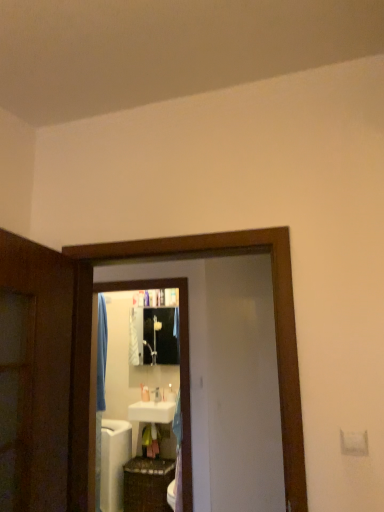
Question: Would you say white matte screen door at center, placed as the 2th screen door when sorted from front to back, contains black glossy mirror at center?

Choices:
 (A) no
 (B) yes

Answer: (A)

Question: Is white matte screen door at center, placed as the 2th screen door when sorted from front to back, outside of black glossy mirror at center?

Choices:
 (A) no
 (B) yes

Answer: (B)

Question: From the image's perspective, is white matte screen door at center, which appears as the 1th screen door when viewed from the back, under black glossy mirror at center?

Choices:
 (A) no
 (B) yes

Answer: (A)

Question: From a real-world perspective, is white matte screen door at center, which appears as the 1th screen door when viewed from the back, physically below black glossy mirror at center?

Choices:
 (A) no
 (B) yes

Answer: (A)

Question: Is white matte screen door at center, which appears as the 1th screen door when viewed from the back, closer to the viewer compared to black glossy mirror at center?

Choices:
 (A) yes
 (B) no

Answer: (A)

Question: Considering the positions of point (228, 335) and point (187, 482), is point (228, 335) closer or farther from the camera than point (187, 482)?

Choices:
 (A) closer
 (B) farther

Answer: (B)

Question: From a real-world perspective, is white matte screen door at center, which appears as the 1th screen door when viewed from the back, physically located above or below black glossy mirror at center?

Choices:
 (A) below
 (B) above

Answer: (B)

Question: Based on their sizes in the image, would you say white matte screen door at center, which appears as the 1th screen door when viewed from the back, is bigger or smaller than black glossy mirror at center?

Choices:
 (A) big
 (B) small

Answer: (B)

Question: Relative to black glossy mirror at center, is white matte screen door at center, which appears as the 1th screen door when viewed from the back, in front or behind?

Choices:
 (A) behind
 (B) front

Answer: (B)

Question: In the image, is white glossy bath at lower left positioned in front of or behind white glossy soap dispenser at center, marked as the 1th toiletry in a left-to-right arrangement?

Choices:
 (A) behind
 (B) front

Answer: (B)

Question: Which is correct: white glossy bath at lower left is inside white glossy soap dispenser at center, the second toiletry positioned from the front, or outside of it?

Choices:
 (A) outside
 (B) inside

Answer: (A)

Question: Does point (114, 461) appear closer or farther from the camera than point (144, 388)?

Choices:
 (A) farther
 (B) closer

Answer: (B)

Question: From the image's perspective, is white glossy bath at lower left positioned above or below white glossy soap dispenser at center, the second toiletry positioned from the front?

Choices:
 (A) above
 (B) below

Answer: (B)

Question: Considering the positions of white glossy bath at lower left and black glossy medicine cabinet at center in the image, is white glossy bath at lower left bigger or smaller than black glossy medicine cabinet at center?

Choices:
 (A) small
 (B) big

Answer: (B)

Question: From the image's perspective, relative to black glossy medicine cabinet at center, is white glossy bath at lower left above or below?

Choices:
 (A) above
 (B) below

Answer: (B)